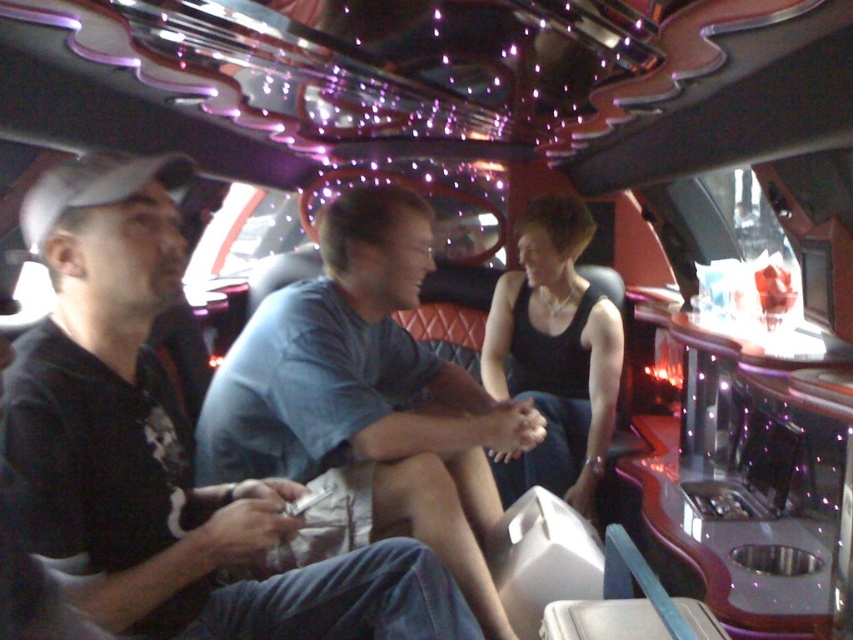
Question: Does blue cotton shirt at center have a larger size compared to black matte tank top at center?

Choices:
 (A) no
 (B) yes

Answer: (A)

Question: Is blue cotton shirt at center to the right of black matte tank top at center from the viewer's perspective?

Choices:
 (A) no
 (B) yes

Answer: (A)

Question: Does blue cotton shirt at center come in front of black matte tank top at center?

Choices:
 (A) no
 (B) yes

Answer: (B)

Question: Which point is farther to the camera?

Choices:
 (A) black matte tank top at center
 (B) blue cotton shirt at center

Answer: (A)